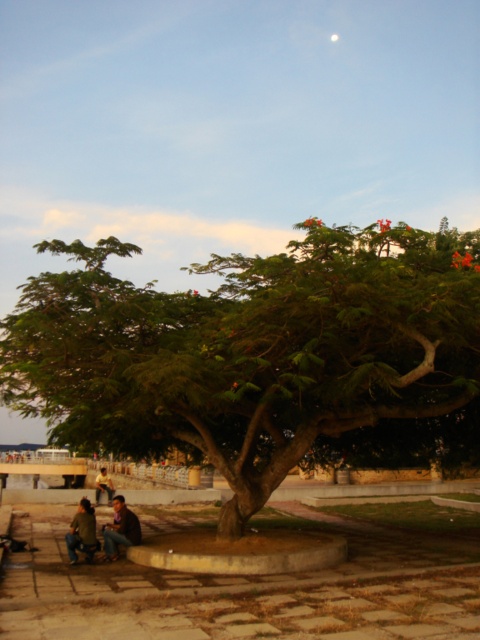
Is green fabric jacket at lower left closer to camera compared to yellow fabric shirt at lower left?

Yes, it is in front of yellow fabric shirt at lower left.

Can you confirm if green fabric jacket at lower left is positioned to the left of yellow fabric shirt at lower left?

No, green fabric jacket at lower left is not to the left of yellow fabric shirt at lower left.

This screenshot has height=640, width=480. In order to click on green fabric jacket at lower left in this screenshot , I will do `click(82, 532)`.

The height and width of the screenshot is (640, 480). I want to click on green fabric jacket at lower left, so click(82, 532).

Who is more distant from viewer, (112,497) or (79,520)?

Positioned behind is point (112,497).

Is dark brown leather jacket at lower left taller than green fabric jacket at lower left?

No.

Is point (110, 552) behind point (81, 500)?

No, (110, 552) is closer to viewer.

This screenshot has width=480, height=640. I want to click on dark brown leather jacket at lower left, so click(120, 529).

Can you confirm if green leafy tree at center is wider than green fabric jacket at lower left?

Yes.

Where is `green leafy tree at center`? This screenshot has height=640, width=480. green leafy tree at center is located at coordinates (249, 349).